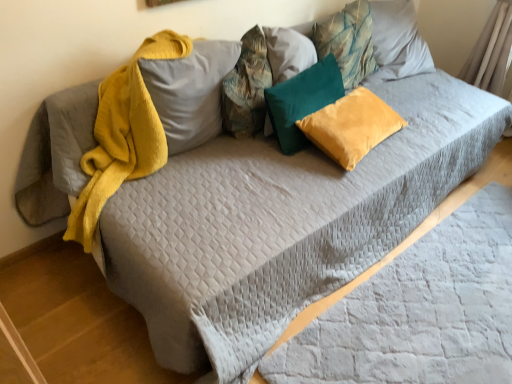
Question: Can you confirm if velvet yellow pillow at center, placed as the fourth pillow when sorted from left to right, is smaller than teal velvet pillow at center, the 3th pillow viewed from the right?

Choices:
 (A) no
 (B) yes

Answer: (B)

Question: Is velvet yellow pillow at center, which is the second pillow in right-to-left order, positioned with its back to teal velvet pillow at center, which ranks as the 3th pillow in left-to-right order?

Choices:
 (A) no
 (B) yes

Answer: (B)

Question: Is velvet yellow pillow at center, placed as the fourth pillow when sorted from left to right, positioned behind teal velvet pillow at center, which ranks as the 3th pillow in left-to-right order?

Choices:
 (A) no
 (B) yes

Answer: (A)

Question: Does velvet yellow pillow at center, which is the second pillow in right-to-left order, have a lesser width compared to teal velvet pillow at center, the 3th pillow viewed from the right?

Choices:
 (A) no
 (B) yes

Answer: (A)

Question: From a real-world perspective, is velvet yellow pillow at center, which is the second pillow in right-to-left order, on top of teal velvet pillow at center, the 3th pillow viewed from the right?

Choices:
 (A) no
 (B) yes

Answer: (A)

Question: In terms of height, does textured fabric pillow at center, the fourth pillow positioned from the right, look taller or shorter compared to teal velvet pillow at center, which ranks as the 3th pillow in left-to-right order?

Choices:
 (A) tall
 (B) short

Answer: (A)

Question: Is textured fabric pillow at center, the fourth pillow positioned from the right, wider or thinner than teal velvet pillow at center, the 3th pillow viewed from the right?

Choices:
 (A) wide
 (B) thin

Answer: (A)

Question: Looking at the image, does textured fabric pillow at center, positioned as the second pillow in left-to-right order, seem bigger or smaller compared to teal velvet pillow at center, which ranks as the 3th pillow in left-to-right order?

Choices:
 (A) big
 (B) small

Answer: (A)

Question: Is textured fabric pillow at center, positioned as the second pillow in left-to-right order, inside or outside of teal velvet pillow at center, the 3th pillow viewed from the right?

Choices:
 (A) inside
 (B) outside

Answer: (B)

Question: Is point (317, 130) positioned closer to the camera than point (345, 51)?

Choices:
 (A) closer
 (B) farther

Answer: (A)

Question: In terms of height, does velvet yellow pillow at center, placed as the fourth pillow when sorted from left to right, look taller or shorter compared to teal fabric pillow at upper center, placed as the 5th pillow when sorted from left to right?

Choices:
 (A) tall
 (B) short

Answer: (B)

Question: From the image's perspective, is velvet yellow pillow at center, which is the second pillow in right-to-left order, positioned above or below teal fabric pillow at upper center, placed as the 5th pillow when sorted from left to right?

Choices:
 (A) above
 (B) below

Answer: (B)

Question: From a real-world perspective, is velvet yellow pillow at center, placed as the fourth pillow when sorted from left to right, positioned above or below teal fabric pillow at upper center, placed as the 5th pillow when sorted from left to right?

Choices:
 (A) above
 (B) below

Answer: (B)

Question: Considering the relative positions of teal velvet pillow at center, the 3th pillow viewed from the right, and gray quilted sheet at lower right in the image provided, is teal velvet pillow at center, the 3th pillow viewed from the right, to the left or to the right of gray quilted sheet at lower right?

Choices:
 (A) left
 (B) right

Answer: (A)

Question: From a real-world perspective, relative to gray quilted sheet at lower right, is teal velvet pillow at center, which ranks as the 3th pillow in left-to-right order, vertically above or below?

Choices:
 (A) below
 (B) above

Answer: (B)